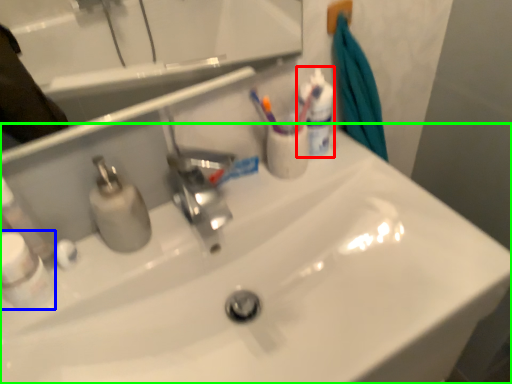
Question: Which is nearer to the mouthwash (highlighted by a red box)? mouthwash (highlighted by a blue box) or sink (highlighted by a green box).

Choices:
 (A) mouthwash
 (B) sink

Answer: (B)